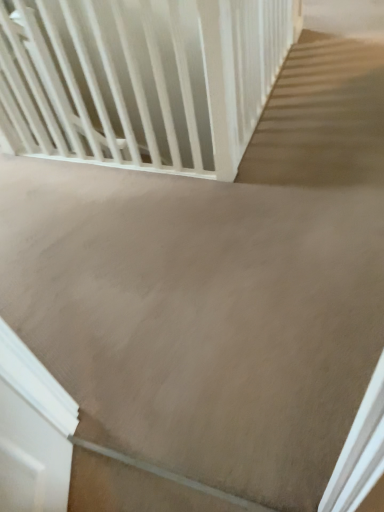
In order to face white matte gate at upper left, should I rotate leftwards or rightwards?

To face it directly, rotate left by 15.323 degrees.

What is the approximate height of white matte gate at upper left?

31.79 inches.

The image size is (384, 512). What do you see at coordinates (140, 80) in the screenshot? I see `white matte gate at upper left` at bounding box center [140, 80].

You are a GUI agent. You are given a task and a screenshot of the screen. Output one action in this format:
    pyautogui.click(x=<x>, y=<y>)
    Task: Click on the white matte gate at upper left
    The width and height of the screenshot is (384, 512).
    Given the screenshot: What is the action you would take?
    (140, 80)

At what (x,y) coordinates should I click in order to perform the action: click on white matte gate at upper left. Please return your answer as a coordinate pair (x, y). Image resolution: width=384 pixels, height=512 pixels. Looking at the image, I should click on (140, 80).